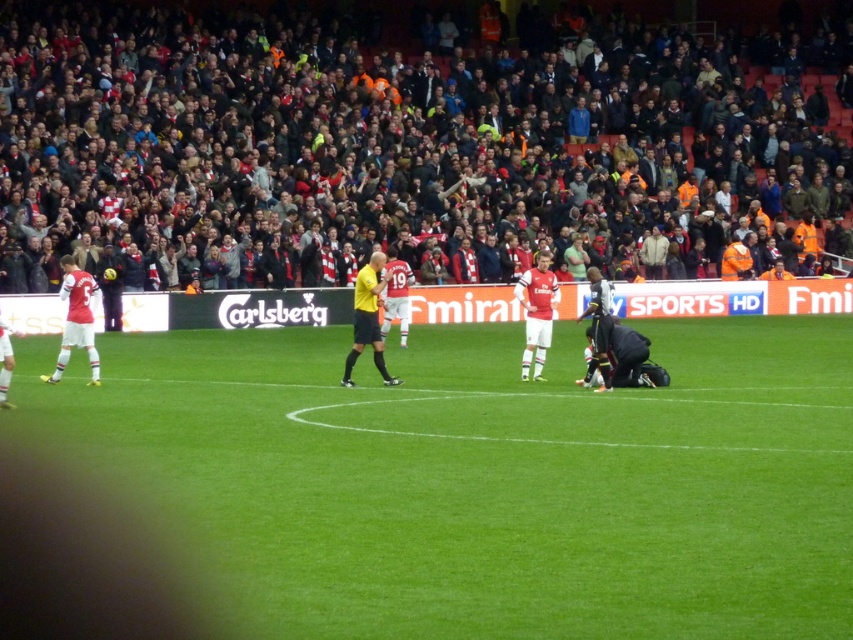
Between point (538, 272) and point (372, 342), which one is positioned behind?

Positioned behind is point (538, 272).

Can you confirm if white jersey at center is wider than yellow uniformed official at center?

Yes.

Where is `white jersey at center`? This screenshot has height=640, width=853. white jersey at center is located at coordinates (537, 310).

Which is in front, point (526, 445) or point (543, 333)?

Positioned in front is point (526, 445).

This screenshot has height=640, width=853. In order to click on green grass field at center in this screenshot , I will do `click(485, 477)`.

Locate an element on the screen. The height and width of the screenshot is (640, 853). green grass field at center is located at coordinates (485, 477).

Who is more forward, (80,333) or (370,321)?

Point (80,333) is in front.

Find the location of a particular element. The image size is (853, 640). white jersey at left is located at coordinates (76, 317).